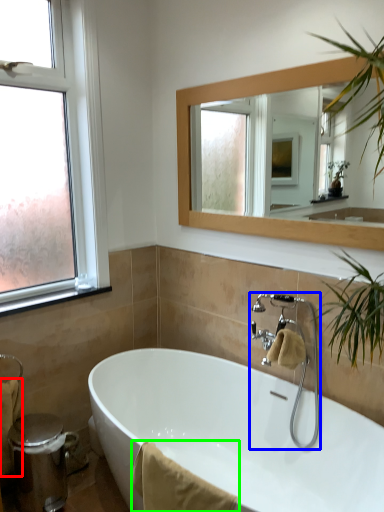
Question: Which object is the farthest from bath towel (highlighted by a red box)? Choose among these: tap (highlighted by a blue box) or bath towel (highlighted by a green box).

Choices:
 (A) tap
 (B) bath towel

Answer: (A)